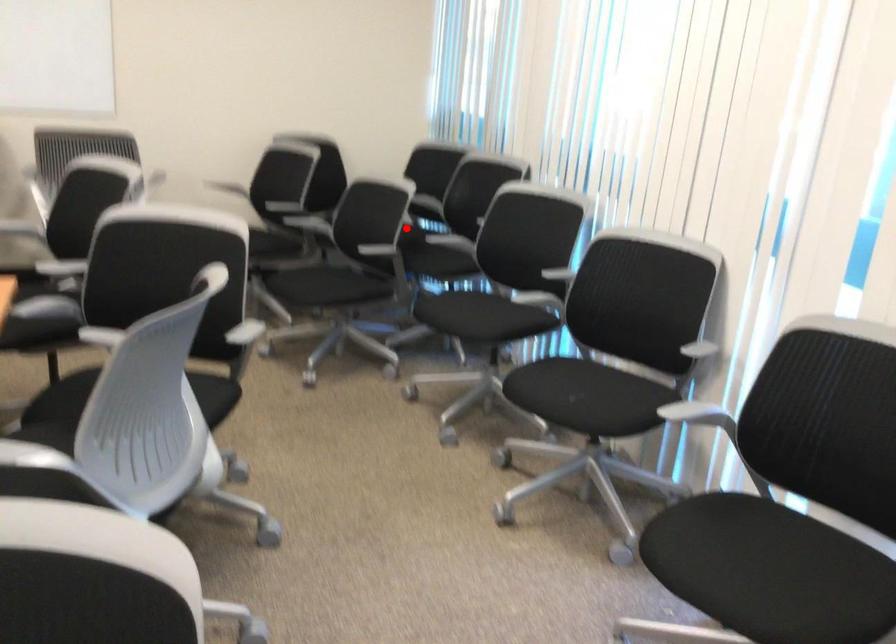
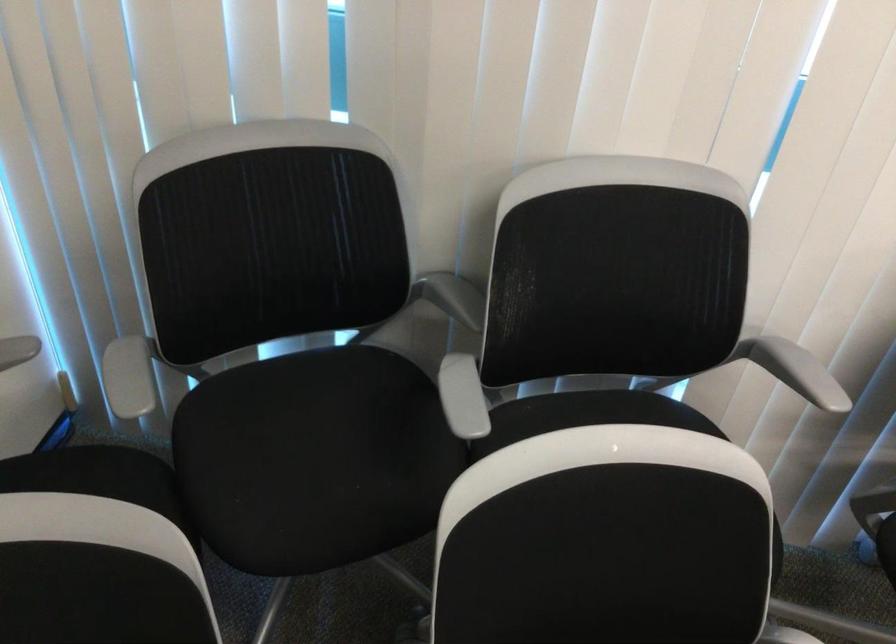
Where in the second image is the point corresponding to the highlighted location from the first image?

(312, 442)